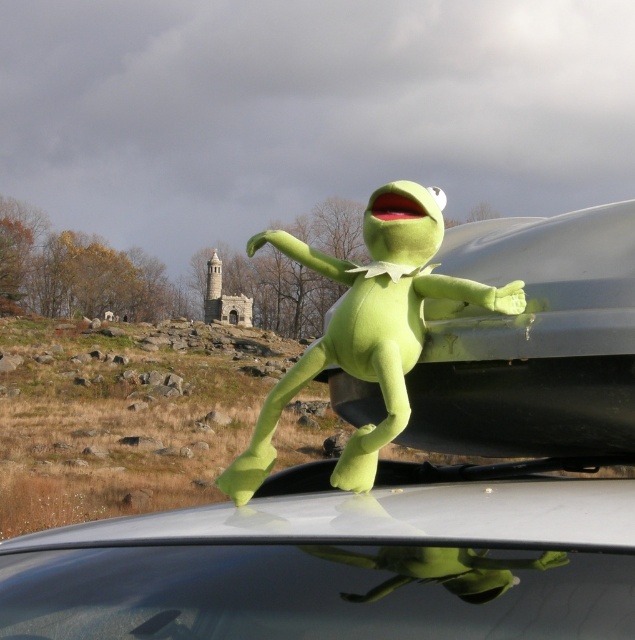
Question: Is metallic gray car at center thinner than green plush toy at center?

Choices:
 (A) no
 (B) yes

Answer: (B)

Question: Which of the following is the closest to the observer?

Choices:
 (A) green plush toy at center
 (B) metallic gray car at center

Answer: (B)

Question: Which point is farther from the camera taking this photo?

Choices:
 (A) (490, 300)
 (B) (589, 456)

Answer: (B)

Question: In this image, where is metallic gray car at center located relative to green plush toy at center?

Choices:
 (A) left
 (B) right

Answer: (B)

Question: Does metallic gray car at center have a larger size compared to green plush toy at center?

Choices:
 (A) yes
 (B) no

Answer: (B)

Question: Which point is farther to the camera?

Choices:
 (A) metallic gray car at center
 (B) green plush toy at center

Answer: (B)